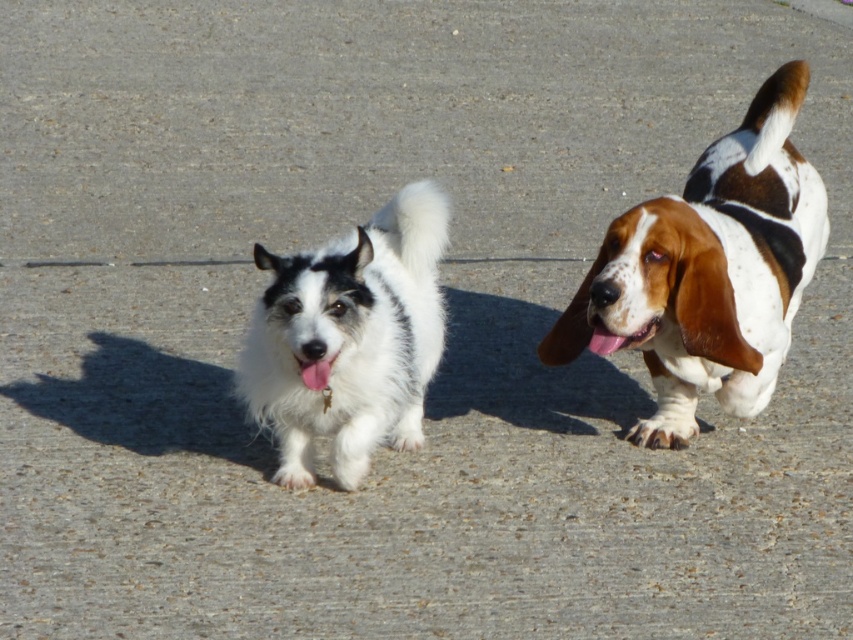
You are a dog owner trying to fit both your brown and white fur dog at right and your white fluffy dog at center into a dog carrier that is 1.2 meters wide. Based on the image, can you determine if both dogs can fit side by side?

The brown and white fur dog at right might be wider than white fluffy dog at center. Since the carrier is 1.2 meters wide, but the exact widths are not provided, it is uncertain if they can fit together. Consider measuring the dogs or choosing a larger carrier to be safe.

You are a dog owner who wants to ensure your pets are comfortable. You notice two dogs in the image. The white fluffy dog at center and the white fur tongue at center. How far apart are these two parts?

The distance between the white fluffy dog at center and the white fur tongue at center is 12.60 inches.

You are a photographer trying to capture both the brown and white fur dog at right and the white fur tongue at center in a single frame. Based on their positions, which dog is closer to the center of the image?

The white fur tongue at center is closer to the center of the image because the brown and white fur dog at right is positioned to the right of it.